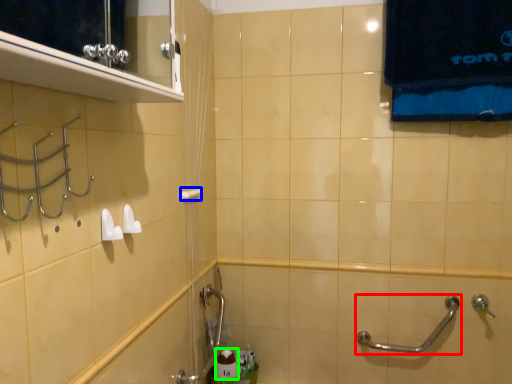
Question: Which object is the farthest from door handle (highlighted by a red box)? Choose among these: towel bar (highlighted by a blue box) or toiletry (highlighted by a green box).

Choices:
 (A) towel bar
 (B) toiletry

Answer: (A)